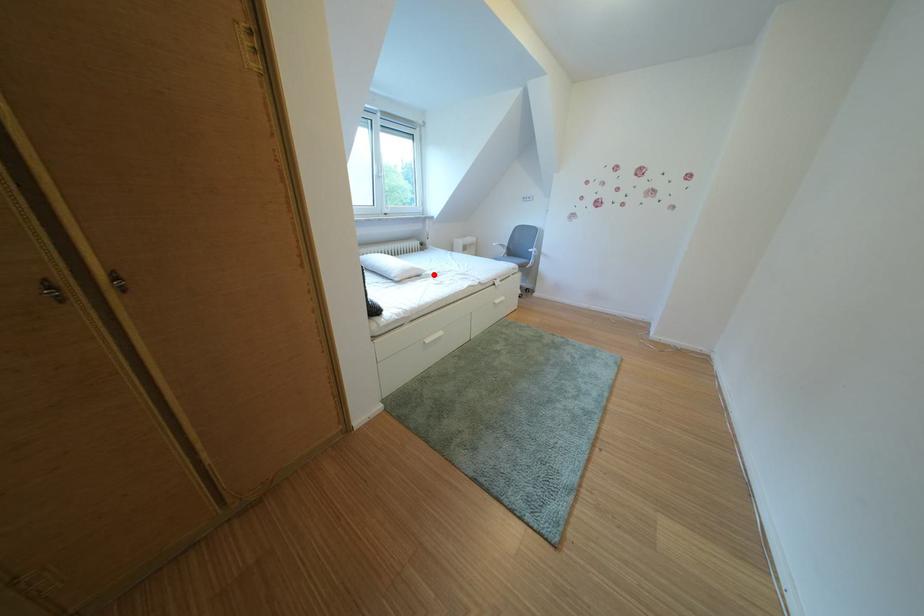
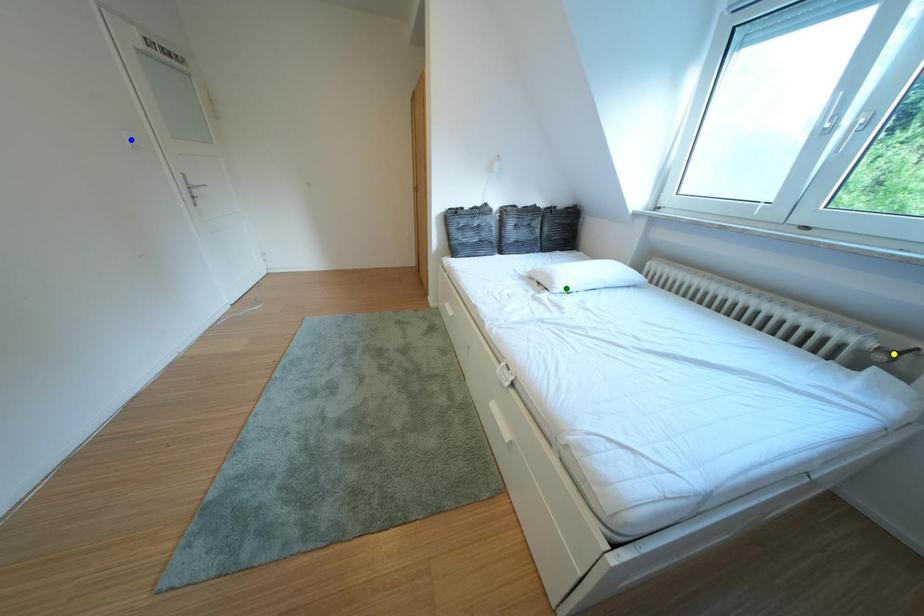
Question: I am providing you with two images of the same scene from different viewpoints. A red point is marked on the first image. You are given multiple points on the second image. Which spot in image 2 lines up with the point in image 1?

Choices:
 (A) blue point
 (B) green point
 (C) yellow point

Answer: (B)